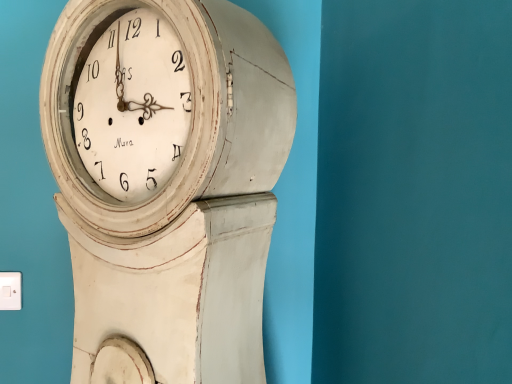
The image size is (512, 384). Describe the element at coordinates (167, 181) in the screenshot. I see `white distressed wood wall clock at center-left` at that location.

Where is `white distressed wood wall clock at center-left`? The height and width of the screenshot is (384, 512). white distressed wood wall clock at center-left is located at coordinates (167, 181).

Locate an element on the screen. This screenshot has width=512, height=384. white distressed wood wall clock at center-left is located at coordinates (167, 181).